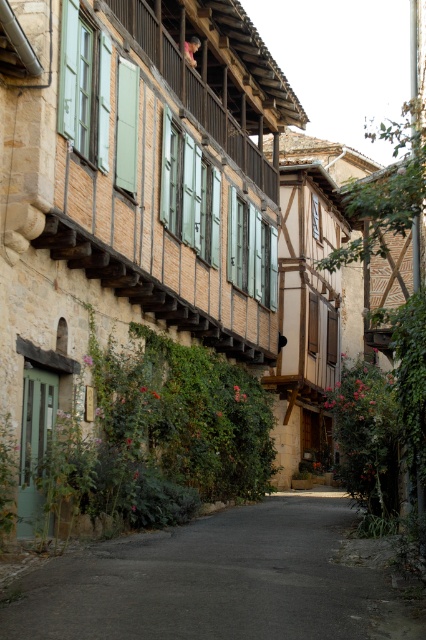
Question: Considering the relative positions of dark asphalt road at center and green wooden balcony at upper center in the image provided, where is dark asphalt road at center located with respect to green wooden balcony at upper center?

Choices:
 (A) above
 (B) below

Answer: (B)

Question: Among these points, which one is farthest from the camera?

Choices:
 (A) pos(256,182)
 (B) pos(241,509)

Answer: (A)

Question: Can you confirm if dark asphalt road at center is smaller than green wooden balcony at upper center?

Choices:
 (A) no
 (B) yes

Answer: (B)

Question: Does dark asphalt road at center appear under green wooden balcony at upper center?

Choices:
 (A) no
 (B) yes

Answer: (B)

Question: Among these objects, which one is nearest to the camera?

Choices:
 (A) green wooden balcony at upper center
 (B) dark asphalt road at center

Answer: (B)